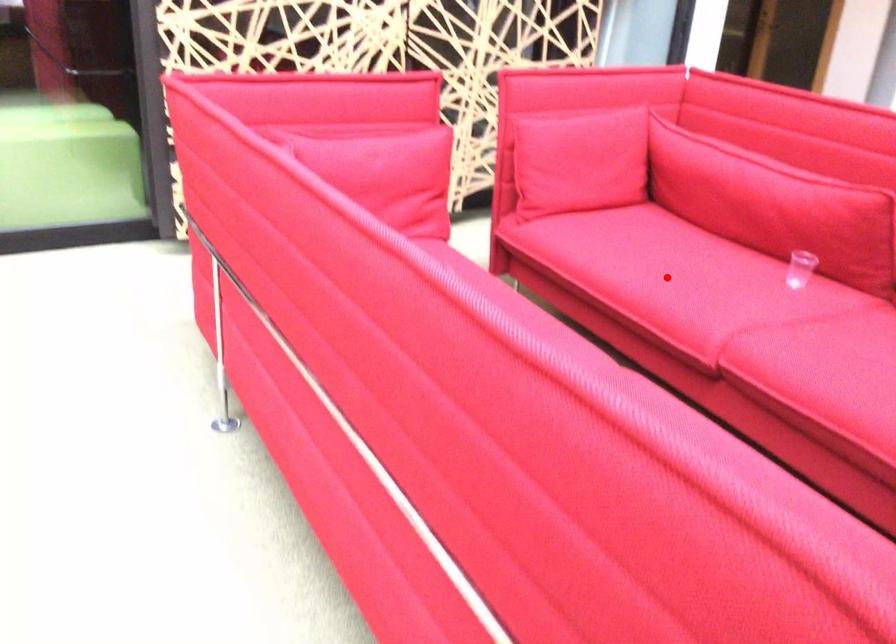
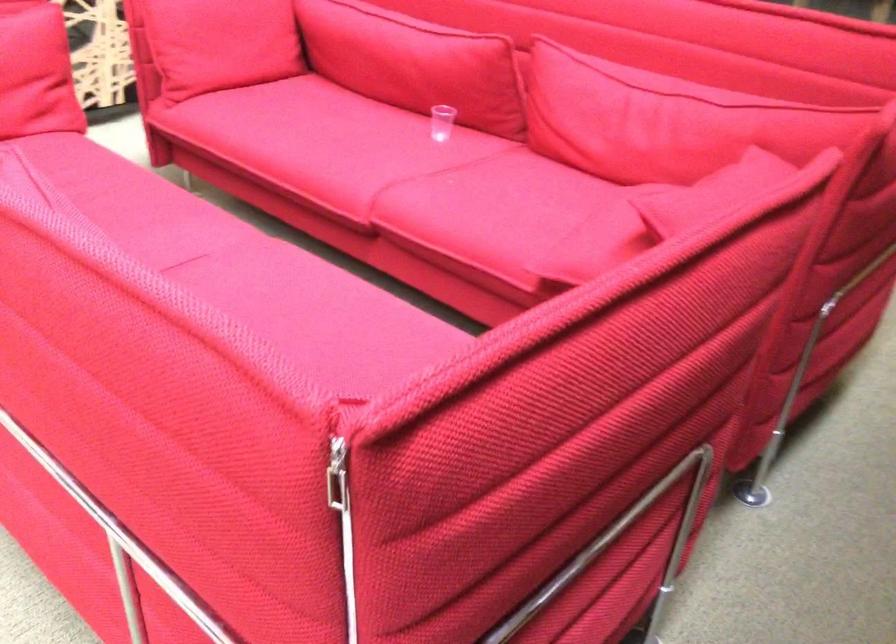
In the second image, find the point that corresponds to the highlighted location in the first image.

(320, 146)